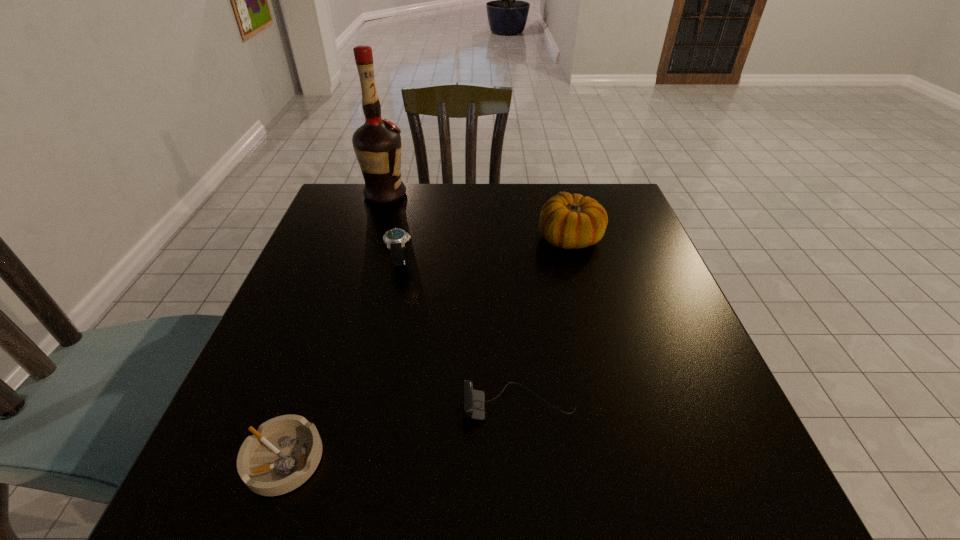
What are the coordinates of `free point that satisfies the following two spatial constraints: 1. on the front and back of the farthest object; 2. on the back side of the third shortest object` in the screenshot? It's located at (365, 261).

Identify the location of free space that satisfies the following two spatial constraints: 1. on the front and back of the liquor; 2. on the back side of the gourd. (372, 238).

Where is `free location that satisfies the following two spatial constraints: 1. on the back side of the third tallest object; 2. on the front and back of the tallest object`? This screenshot has height=540, width=960. free location that satisfies the following two spatial constraints: 1. on the back side of the third tallest object; 2. on the front and back of the tallest object is located at coordinates pos(415,194).